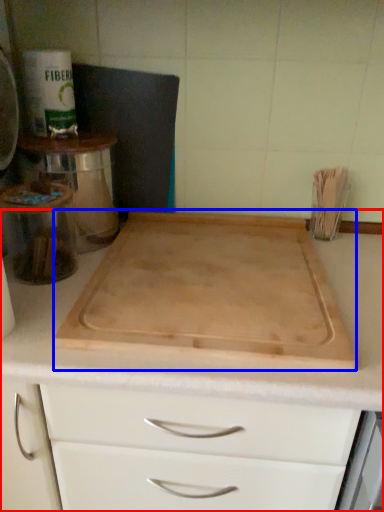
Question: Which object is closer to the camera taking this photo, countertop (highlighted by a red box) or cutting board (highlighted by a blue box)?

Choices:
 (A) countertop
 (B) cutting board

Answer: (A)